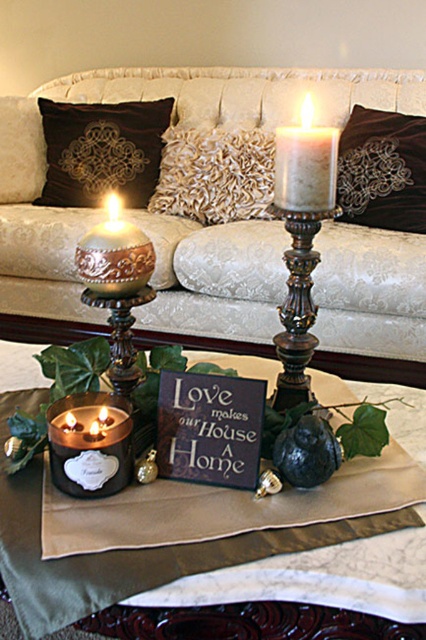
You are arranging a photo shoot and need to place a 12 inch wide camera on the coffee table. The velvet pillow at upper left and gold textured pillow at center are already there. Can you fit the camera between them without moving the pillows?

The velvet pillow at upper left might be wider than gold textured pillow at center, so there may not be enough space to fit the 12 inch wide camera between them. Check the actual distance first.

You are arranging a living room and want to place a new decorative item on the coffee table. The velvet brown pillow at center is currently at position coordinates 0.267, 0.899. If you want to place the new item exactly 0.1 units to the right of the pillow, what would be the new coordinates?

The new coordinates would be (x=382, y=234) because adding 0.1 to the x coordinate of the velvet brown pillow at center moves it 0.1 units to the right while keeping the y coordinate the same.